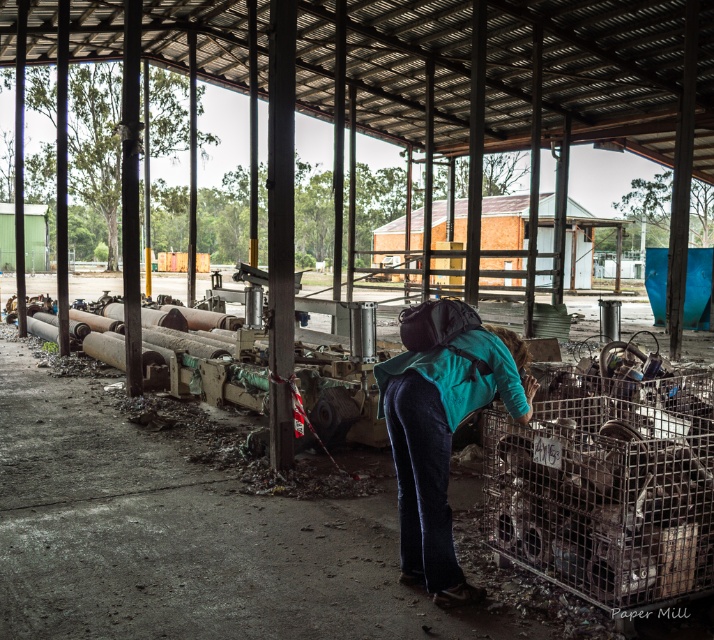
Between teal fabric backpack at center and brown wooden hut at center, which one has less height?

Standing shorter between the two is teal fabric backpack at center.

Is teal fabric backpack at center shorter than brown wooden hut at center?

Correct, teal fabric backpack at center is not as tall as brown wooden hut at center.

Is point (461, 589) positioned before point (466, 227)?

Yes, it is in front of point (466, 227).

The height and width of the screenshot is (640, 714). Identify the location of teal fabric backpack at center. (441, 426).